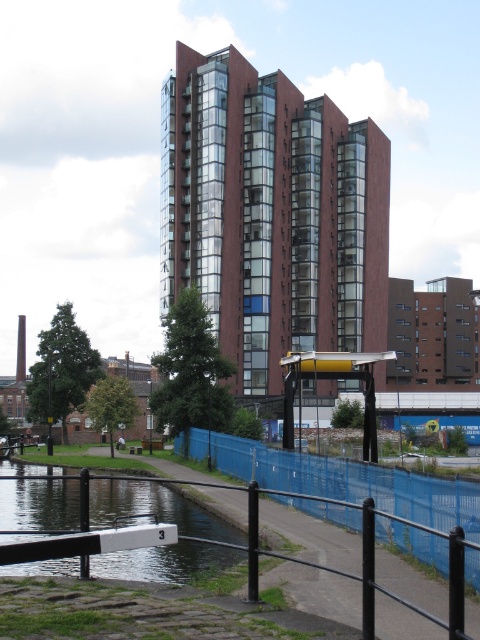
You are standing at the center of the image. Which direction should you walk to reach the smooth concrete river at lower left?

You should walk towards the lower left direction to reach the smooth concrete river at lower left.

You are a delivery person carrying a large package that is 2 meters wide. You need to cross the smooth concrete river at lower left to reach the wooden park bench at center. Is there enough space to walk across the river without the package getting stuck?

The smooth concrete river at lower left might be wider than the wooden park bench at center, so there is a possibility that the river is wide enough for the 2m wide package. However, since the exact width isn not specified, it is uncertain. Please check the actual width before proceeding.

You are standing at the origin point of the scene. Can you tell me the coordinates of the blue plastic fence at lower center?

The blue plastic fence at lower center is located at coordinates point (x=352, y=483).